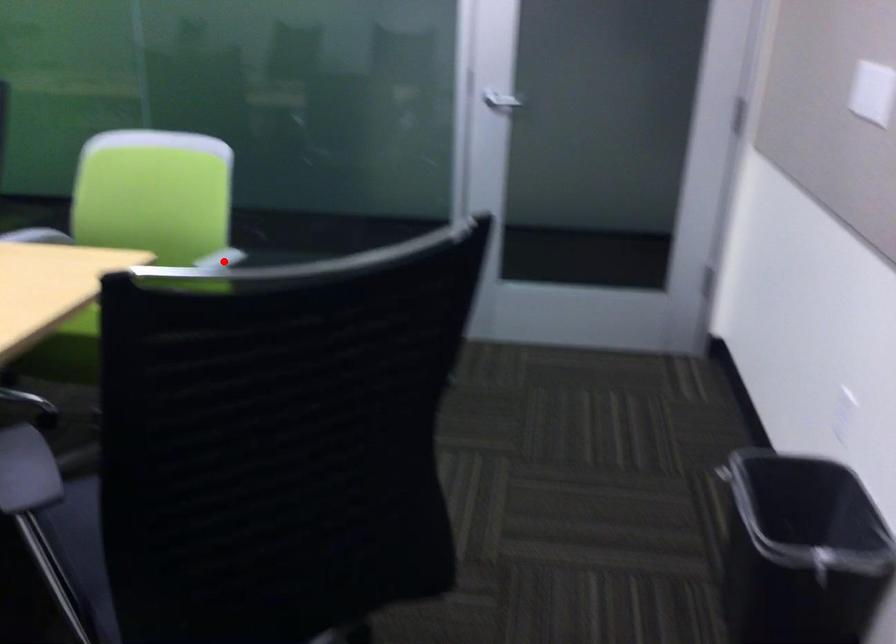
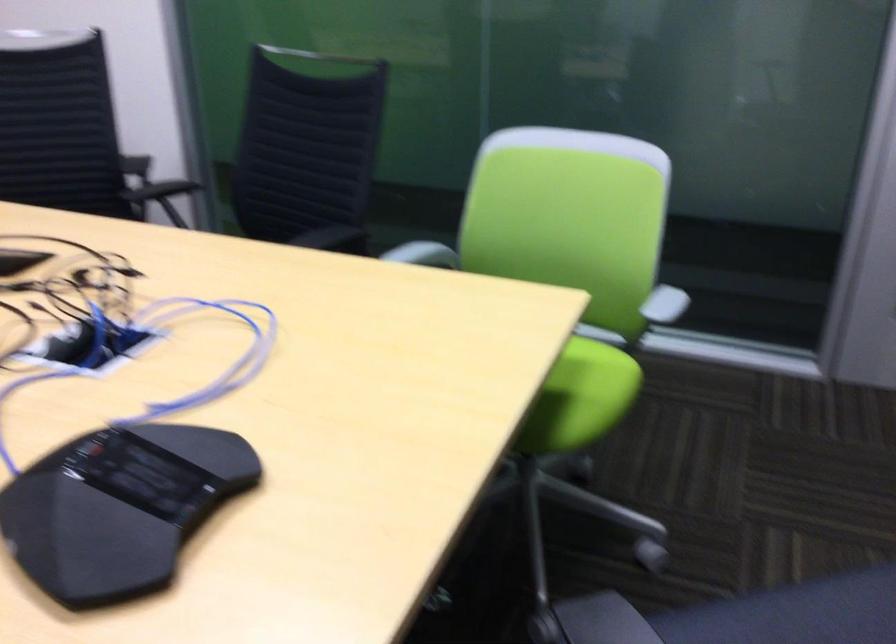
Find the pixel in the second image that matches the highlighted location in the first image.

(659, 310)